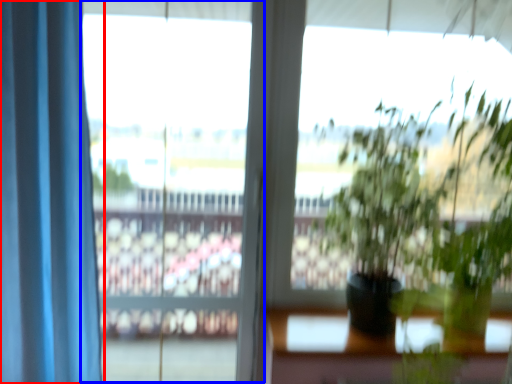
Question: Which of the following is the farthest to the observer, curtain (highlighted by a red box) or window frame (highlighted by a blue box)?

Choices:
 (A) curtain
 (B) window frame

Answer: (B)